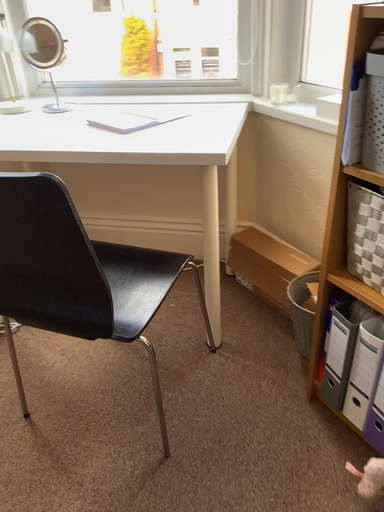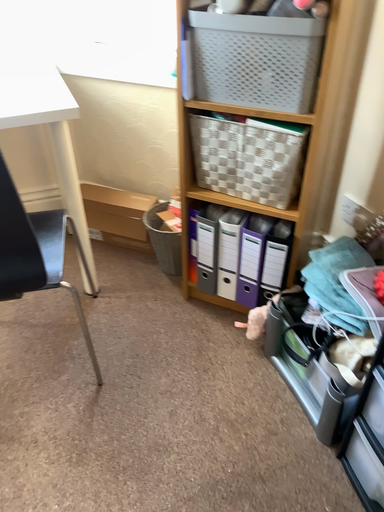
Question: How did the camera likely rotate when shooting the video?

Choices:
 (A) rotated left
 (B) rotated right

Answer: (B)